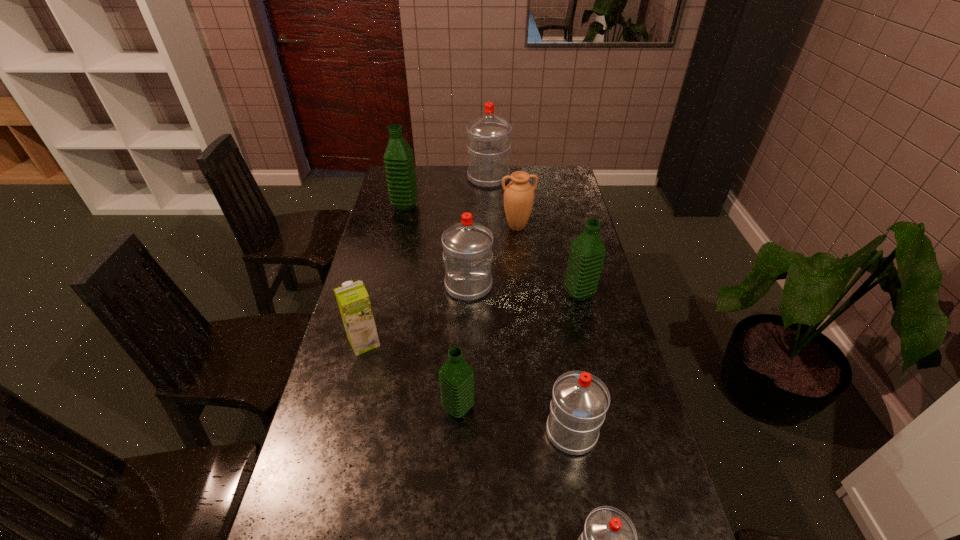
In order to click on free space located on the handle side of the third biggest white water bottle in this screenshot , I will do `click(562, 372)`.

This screenshot has height=540, width=960. In order to click on free location located 0.400m on the back of the smallest green water bottle in this screenshot , I will do `click(463, 294)`.

Where is `object positioned at the far edge`? This screenshot has width=960, height=540. object positioned at the far edge is located at coordinates (488, 136).

The height and width of the screenshot is (540, 960). What are the coordinates of `water bottle present at the left edge` in the screenshot? It's located at (399, 163).

What are the coordinates of `soya milk located at the left edge` in the screenshot? It's located at (353, 300).

In the image, there is a desktop. At what (x,y) coordinates should I click in order to perform the action: click on vacant space at the far edge. Please return your answer as a coordinate pair (x, y). The image size is (960, 540). Looking at the image, I should click on (450, 184).

Locate an element on the screen. The image size is (960, 540). vacant region at the left edge of the desktop is located at coordinates (378, 318).

Where is `free space at the right edge of the desktop`? This screenshot has height=540, width=960. free space at the right edge of the desktop is located at coordinates (671, 512).

In order to click on blank region between the third biggest white water bottle and the biggest green water bottle in this screenshot , I will do `click(489, 319)`.

This screenshot has width=960, height=540. Identify the location of free space between the rightmost green water bottle and the farthest water bottle. (534, 236).